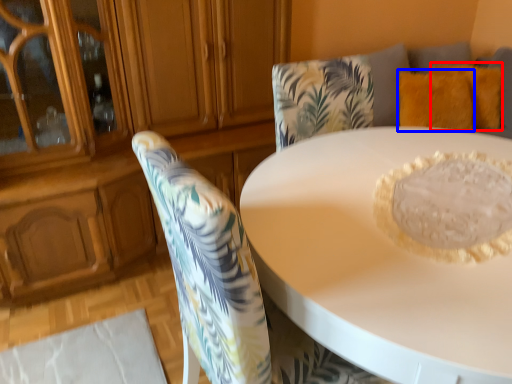
Question: Among these objects, which one is farthest to the camera, pillow (highlighted by a red box) or pillow (highlighted by a blue box)?

Choices:
 (A) pillow
 (B) pillow

Answer: (A)